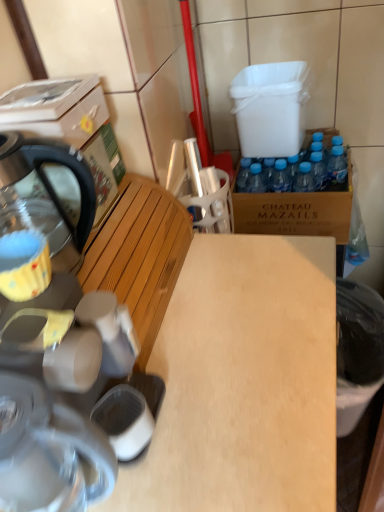
Question: Relative to brown cardboard box at right, is wooden bench at left in front or behind?

Choices:
 (A) behind
 (B) front

Answer: (B)

Question: Considering the relative positions of wooden bench at left and brown cardboard box at right in the image provided, is wooden bench at left to the left or to the right of brown cardboard box at right?

Choices:
 (A) right
 (B) left

Answer: (B)

Question: Estimate the real-world distances between objects in this image. Which object is farther from the metallic silver kettle at left?

Choices:
 (A) wooden bench at left
 (B) brown cardboard box at right
 (C) black plastic trash can at lower right
 (D) stainless steel kettle at left
 (E) light wood desk at center

Answer: (C)

Question: Based on their relative distances, which object is nearer to the wooden bench at left?

Choices:
 (A) light wood desk at center
 (B) metallic silver kettle at left
 (C) matte gray coffee machine at lower left
 (D) stainless steel kettle at left
 (E) yellow fabric coffee cup at left

Answer: (A)